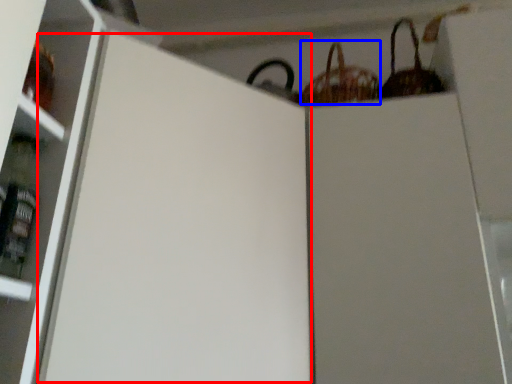
Question: Which object appears farthest to the camera in this image, screen door (highlighted by a red box) or basket (highlighted by a blue box)?

Choices:
 (A) screen door
 (B) basket

Answer: (B)